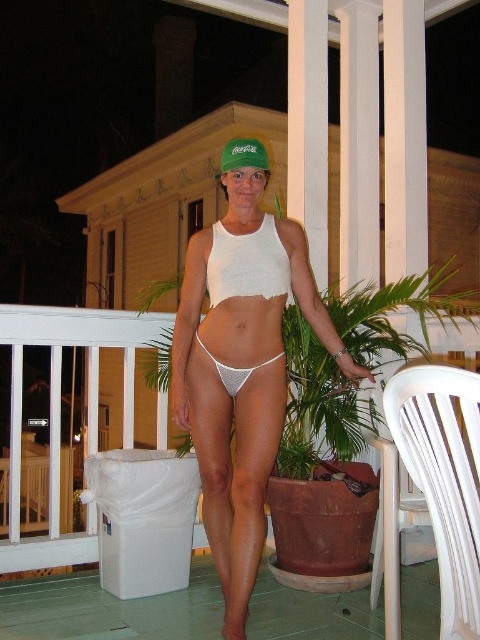
Question: Which point is closer to the camera?

Choices:
 (A) (249, 152)
 (B) (91, 355)

Answer: (A)

Question: Among these objects, which one is nearest to the camera?

Choices:
 (A) white plastic chair at lower right
 (B) green fabric cap at center
 (C) white fabric bikini top at center
 (D) white mesh bikini at center

Answer: (C)

Question: Where is white matte bikini bottom at center located in relation to white mesh bikini at center in the image?

Choices:
 (A) below
 (B) above

Answer: (A)

Question: Is white matte bikini bottom at center bigger than white plastic chair at lower right?

Choices:
 (A) yes
 (B) no

Answer: (B)

Question: Based on their relative distances, which object is nearer to the white plastic chair at lower right?

Choices:
 (A) white fabric bikini top at center
 (B) green fabric cap at center

Answer: (A)

Question: Does white matte bikini bottom at center have a larger size compared to white plastic chair at lower right?

Choices:
 (A) yes
 (B) no

Answer: (B)